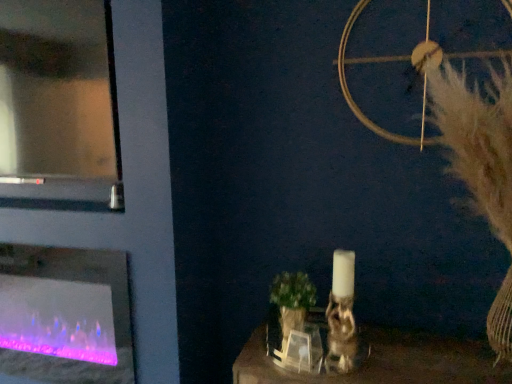
Locate an element on the screen. vacant region above translucent glass fireplace at left (from a real-world perspective) is located at coordinates (51, 238).